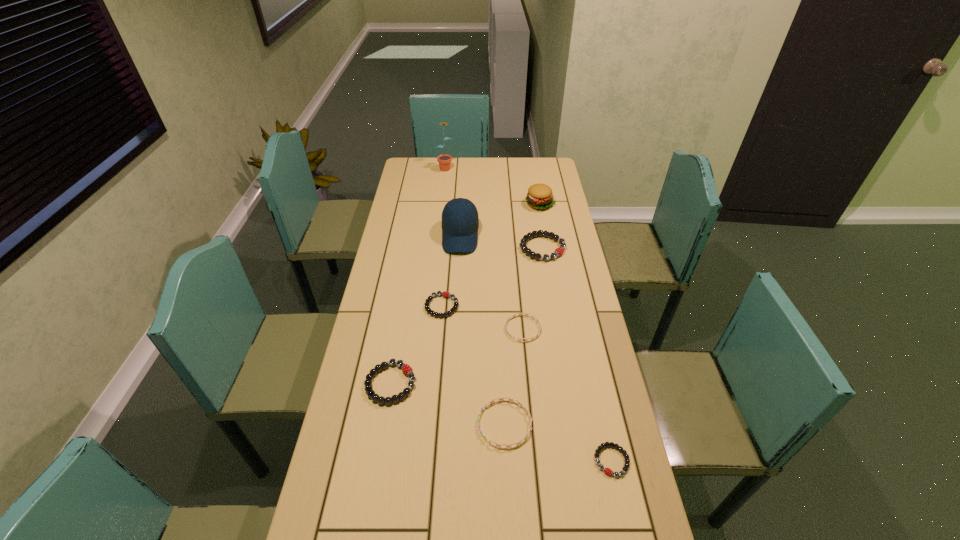
This screenshot has width=960, height=540. What are the coordinates of `the bigger blue bracelet` in the screenshot? It's located at click(490, 402).

You are a GUI agent. You are given a task and a screenshot of the screen. Output one action in this format:
    pyautogui.click(x=<x>, y=<y>)
    Task: Click on the second smallest black bracelet
    The image size is (960, 540).
    Given the screenshot: What is the action you would take?
    pyautogui.click(x=427, y=302)

This screenshot has width=960, height=540. In order to click on the smaller blue bracelet in this screenshot , I will do `click(526, 314)`.

Where is `the smallest black bracelet`? the smallest black bracelet is located at coordinates (608, 471).

Locate an element on the screen. Image resolution: width=960 pixels, height=540 pixels. vacant space located on the flower of the tallest object is located at coordinates (443, 190).

Identify the location of vacant space located on the front-facing side of the second tallest object. Image resolution: width=960 pixels, height=540 pixels. (458, 274).

The image size is (960, 540). I want to click on free space located on the left of the hamburger, so click(x=505, y=204).

Find the location of a particular element. The image size is (960, 540). free spot located 0.250m on the back of the farthest bracelet is located at coordinates (535, 201).

The height and width of the screenshot is (540, 960). Identify the location of vacant point located 0.330m on the right of the second nearest black bracelet. (528, 383).

The height and width of the screenshot is (540, 960). I want to click on vacant space situated on the surface of the bigger blue bracelet showing star-shaped elements, so click(401, 424).